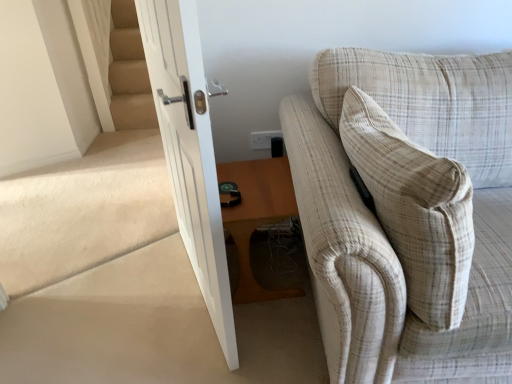
Question: From the image's perspective, does wooden table at lower center appear lower than white plastic electric outlet at upper center?

Choices:
 (A) no
 (B) yes

Answer: (B)

Question: Is wooden table at lower center in front of white plastic electric outlet at upper center?

Choices:
 (A) no
 (B) yes

Answer: (B)

Question: From the image's perspective, is wooden table at lower center over white plastic electric outlet at upper center?

Choices:
 (A) no
 (B) yes

Answer: (A)

Question: Is wooden table at lower center with white plastic electric outlet at upper center?

Choices:
 (A) yes
 (B) no

Answer: (B)

Question: Considering the relative sizes of wooden table at lower center and white plastic electric outlet at upper center in the image provided, is wooden table at lower center bigger than white plastic electric outlet at upper center?

Choices:
 (A) no
 (B) yes

Answer: (B)

Question: Is wooden table at lower center at the left side of white plastic electric outlet at upper center?

Choices:
 (A) yes
 (B) no

Answer: (A)

Question: Is white glossy door at center smaller than beige carpeted stairs at left?

Choices:
 (A) yes
 (B) no

Answer: (B)

Question: Is white glossy door at center oriented away from beige carpeted stairs at left?

Choices:
 (A) no
 (B) yes

Answer: (A)

Question: Can you see white glossy door at center touching beige carpeted stairs at left?

Choices:
 (A) yes
 (B) no

Answer: (B)

Question: Can you confirm if white glossy door at center is thinner than beige carpeted stairs at left?

Choices:
 (A) yes
 (B) no

Answer: (A)

Question: Is white glossy door at center further to camera compared to beige carpeted stairs at left?

Choices:
 (A) no
 (B) yes

Answer: (A)

Question: From the image's perspective, would you say white glossy door at center is positioned over beige carpeted stairs at left?

Choices:
 (A) yes
 (B) no

Answer: (B)

Question: Does white plastic electric outlet at upper center lie in front of white glossy door at center?

Choices:
 (A) yes
 (B) no

Answer: (B)